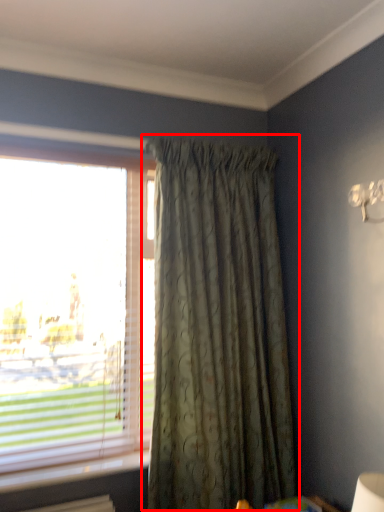
Question: From the image's perspective, considering the relative positions of curtain (annotated by the red box) and window in the image provided, where is curtain (annotated by the red box) located with respect to the staircase?

Choices:
 (A) above
 (B) below

Answer: (B)